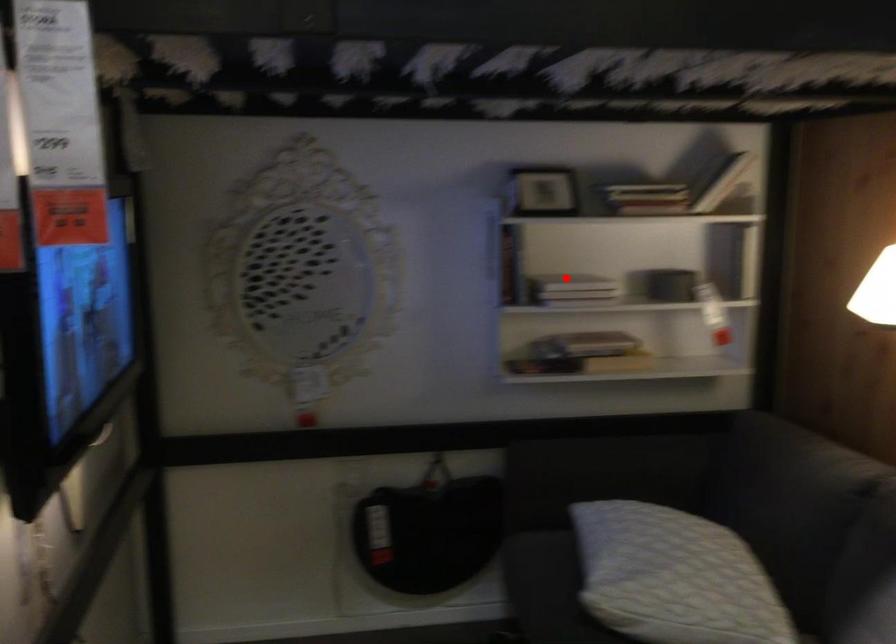
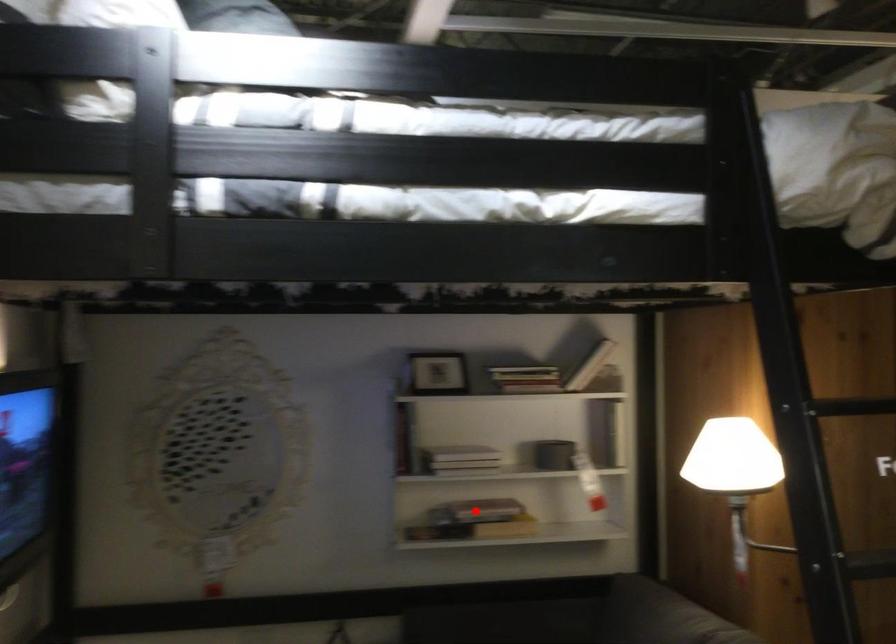
I am providing you with two images of the same scene from different viewpoints. A red point is marked on the first image and another point is marked on the second image. Does the point marked in image1 correspond to the same location as the one in image2?

No